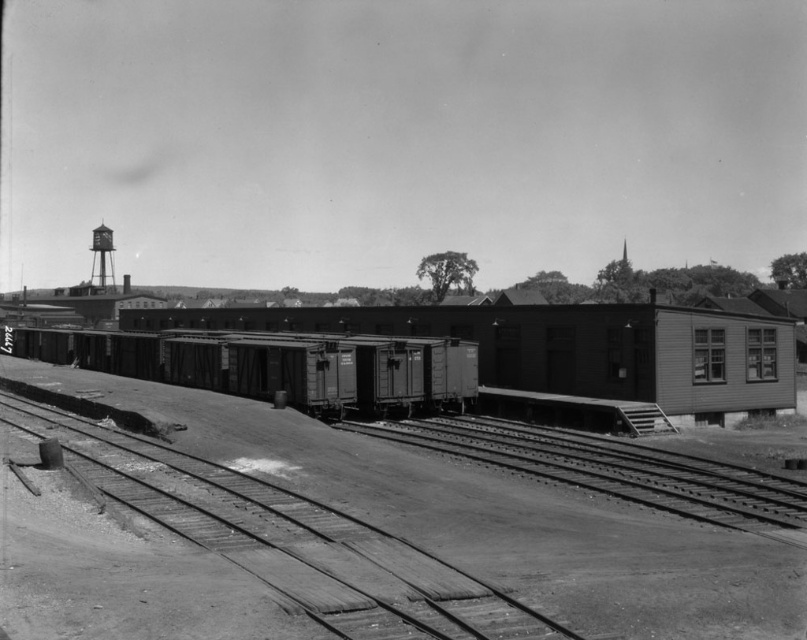
Looking at this image, you are a photographer aiming to capture both the smooth metal train car at center and the smooth metal water tower at upper left in a single shot. Based on their positions, which object will appear larger in the photo?

The smooth metal train car at center will appear larger in the photo because it is closer to the viewer than the smooth metal water tower at upper left.

You are a railway inspector checking the tracks. You notice the smooth wood train track at lower left and the smooth metal water tower at upper left. Which object is positioned to the right when viewed from your perspective?

The smooth wood train track at lower left is positioned to the right of the smooth metal water tower at upper left.

You are a photographer standing in the railway yard and want to capture both the smooth metal train car at center and the smooth metal water tower at upper left in a single photo. Which object should you position closer to the bottom of your camera frame?

You should position the smooth metal train car at center closer to the bottom of your camera frame because it is located below the smooth metal water tower at upper left in the scene.